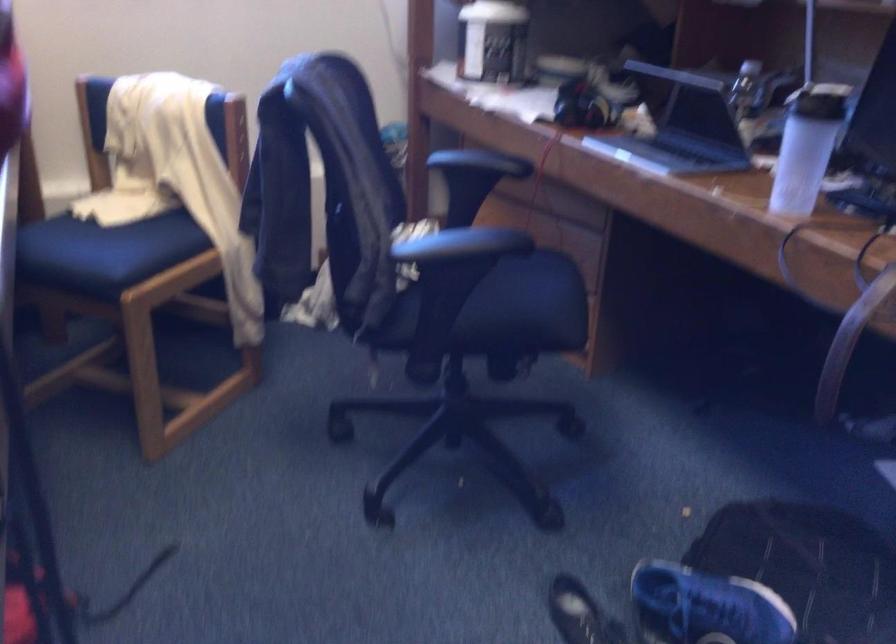
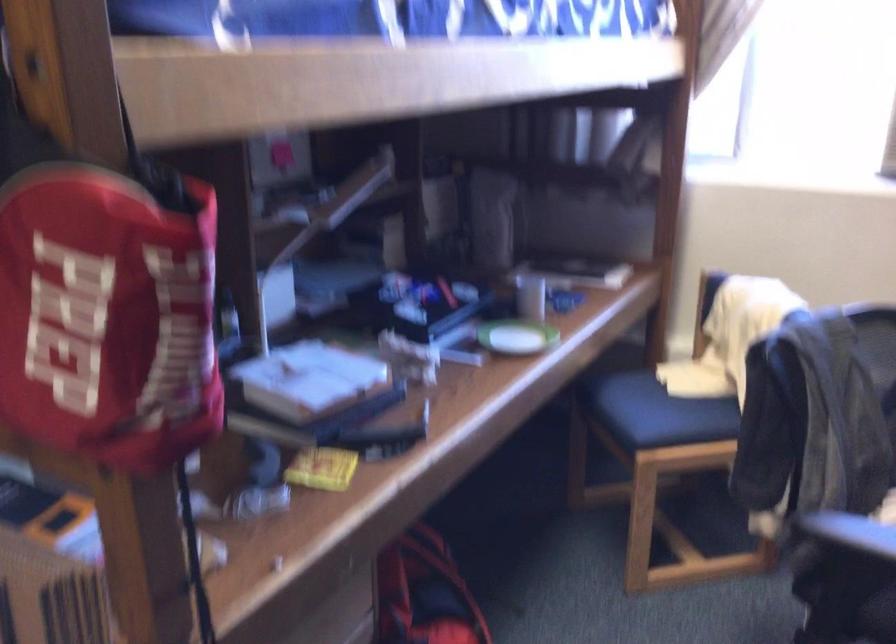
Find the pixel in the second image that matches [134,247] in the first image.

(668, 415)